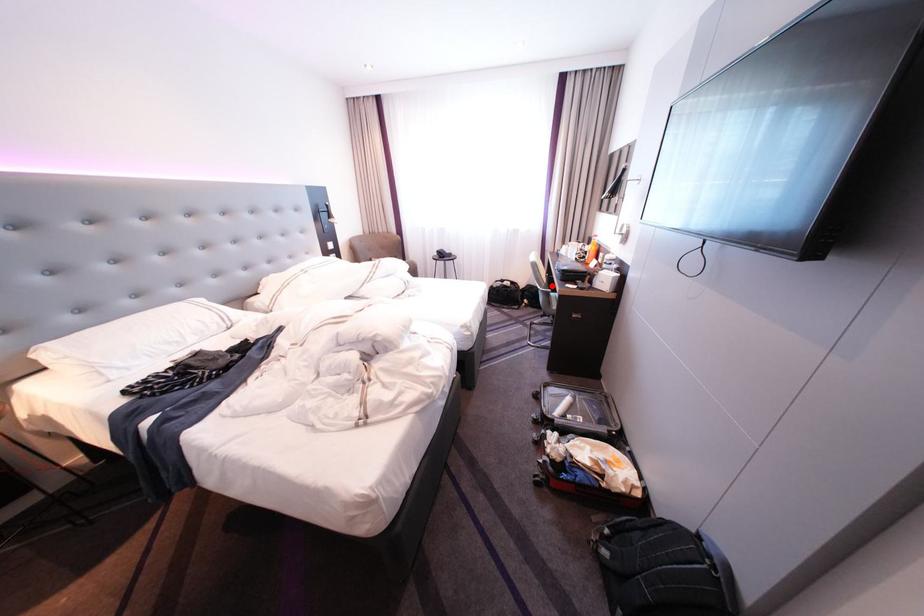
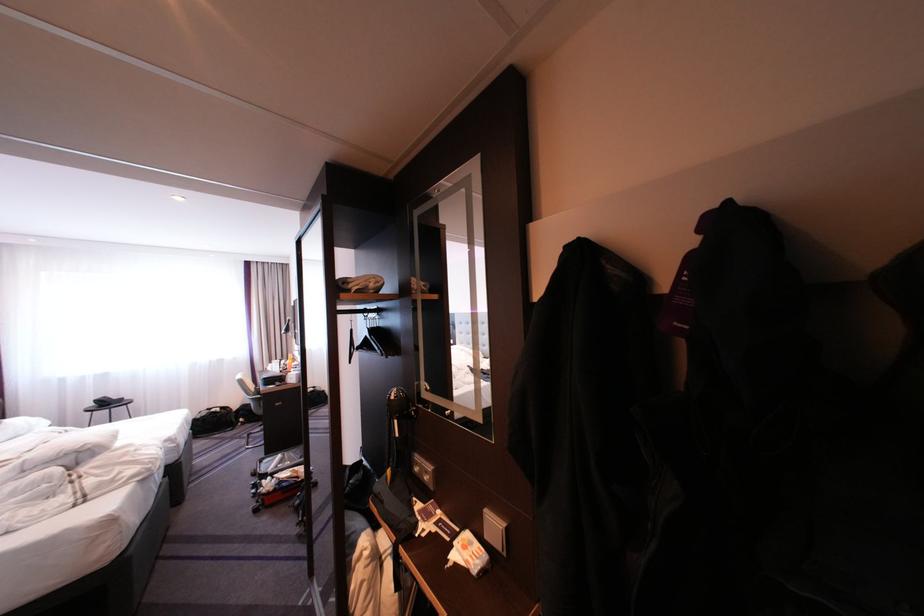
Question: I am providing you with two images of the same scene from different viewpoints. Given a red point in image1, look at the same physical point in image2. Is it:

Choices:
 (A) Closer to the viewpoint
 (B) Farther from the viewpoint

Answer: (B)